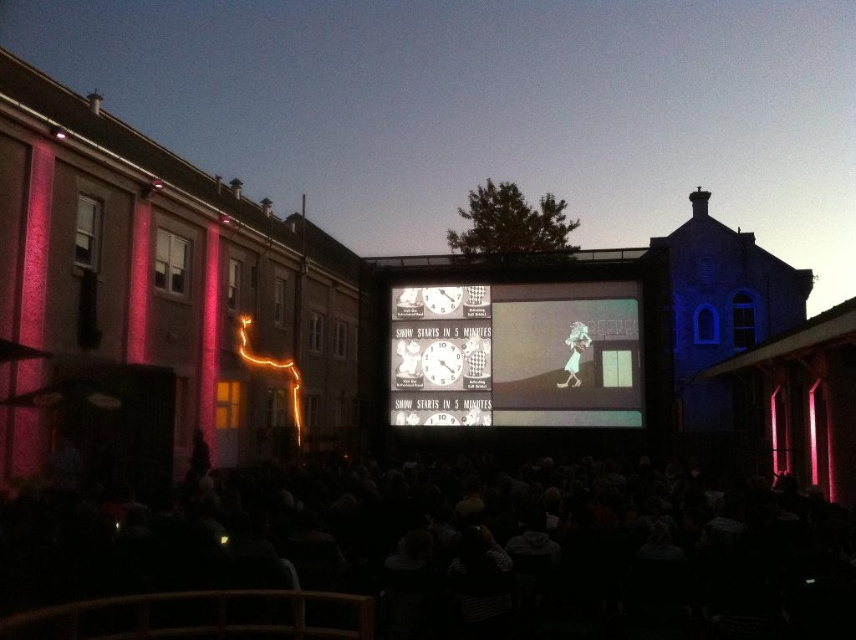
Is black fabric crowd at center thinner than smooth white dress at center?

In fact, black fabric crowd at center might be wider than smooth white dress at center.

Is point (758, 545) positioned in front of point (581, 355)?

Yes, it is.

Where is `black fabric crowd at center`? black fabric crowd at center is located at coordinates (x=464, y=550).

The image size is (856, 640). I want to click on matte plastic screen at center, so click(x=515, y=355).

Is point (637, 378) less distant than point (298, 413)?

Yes, it is.

In order to click on matte plastic screen at center in this screenshot , I will do `click(515, 355)`.

Between yellow neon lights at left and metallic silver clock at center, which one has more height?

yellow neon lights at left is taller.

Can you confirm if yellow neon lights at left is bigger than metallic silver clock at center?

Indeed, yellow neon lights at left has a larger size compared to metallic silver clock at center.

Is point (247, 346) in front of point (437, 353)?

No, it is behind (437, 353).

Find the location of a particular element. yellow neon lights at left is located at coordinates (272, 371).